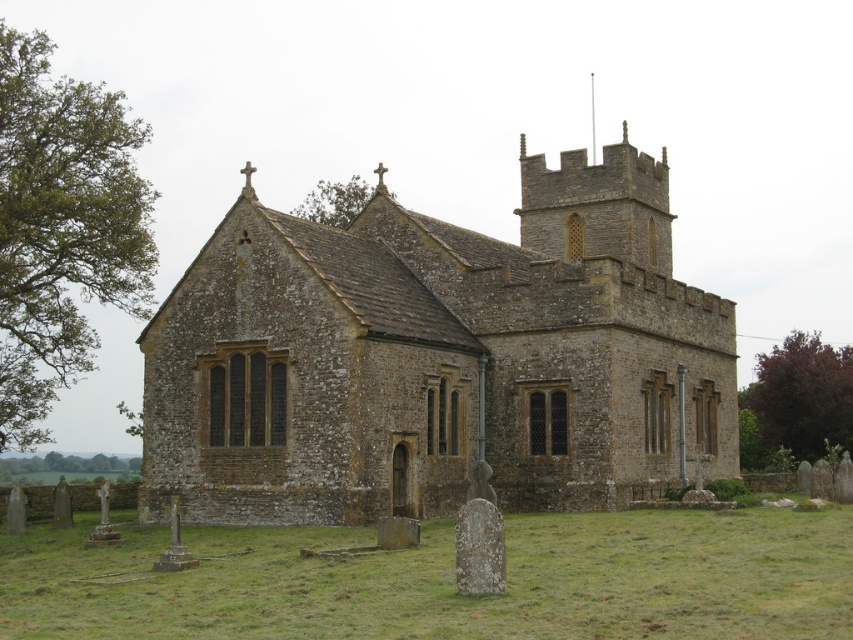
Is green leafy tree at left bigger than purple leafy tree at right?

Indeed, green leafy tree at left has a larger size compared to purple leafy tree at right.

Between green leafy tree at left and purple leafy tree at right, which one has more height?

Standing taller between the two is green leafy tree at left.

What do you see at coordinates (61, 227) in the screenshot? The width and height of the screenshot is (853, 640). I see `green leafy tree at left` at bounding box center [61, 227].

Locate an element on the screen. The image size is (853, 640). green leafy tree at left is located at coordinates (61, 227).

Is the position of green leafy tree at upper center less distant than that of green leafy tree at lower left?

That is True.

Who is more distant from viewer, (339, 180) or (119, 470)?

The point (339, 180) is more distant.

What are the coordinates of `green leafy tree at upper center` in the screenshot? It's located at (334, 202).

Does brown stone church at center have a smaller size compared to green leafy tree at upper center?

No.

Who is higher up, brown stone church at center or green leafy tree at upper center?

green leafy tree at upper center is higher up.

Between point (611, 224) and point (354, 211), which one is positioned in front?

Positioned in front is point (611, 224).

Where is `brown stone church at center`? brown stone church at center is located at coordinates (436, 356).